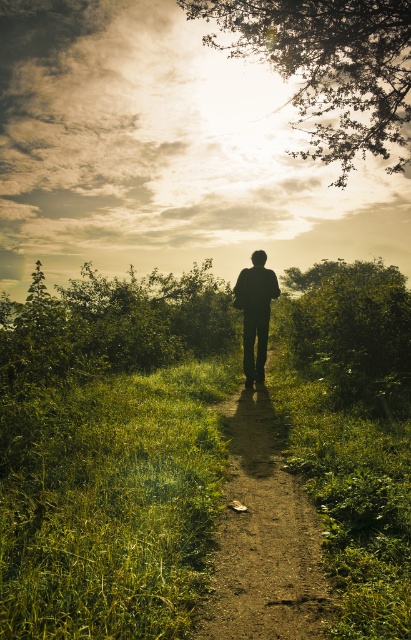
Question: Can you confirm if green grassy at center is positioned to the left of dirt path at center?

Choices:
 (A) no
 (B) yes

Answer: (B)

Question: Can you confirm if silvery metallic branches at upper center is positioned to the right of silhouette figure at center?

Choices:
 (A) no
 (B) yes

Answer: (B)

Question: Which object is the closest to the dirt path at center?

Choices:
 (A) silhouette figure at center
 (B) silvery metallic branches at upper center

Answer: (A)

Question: Among these points, which one is nearest to the camera?

Choices:
 (A) (263, 314)
 (B) (300, 52)
 (C) (27, 381)
 (D) (267, 484)

Answer: (D)

Question: Is green leafy bush at left thinner than silhouette figure at center?

Choices:
 (A) no
 (B) yes

Answer: (A)

Question: Which point is farther to the camera?

Choices:
 (A) (168, 284)
 (B) (249, 305)
 (C) (239, 561)

Answer: (A)